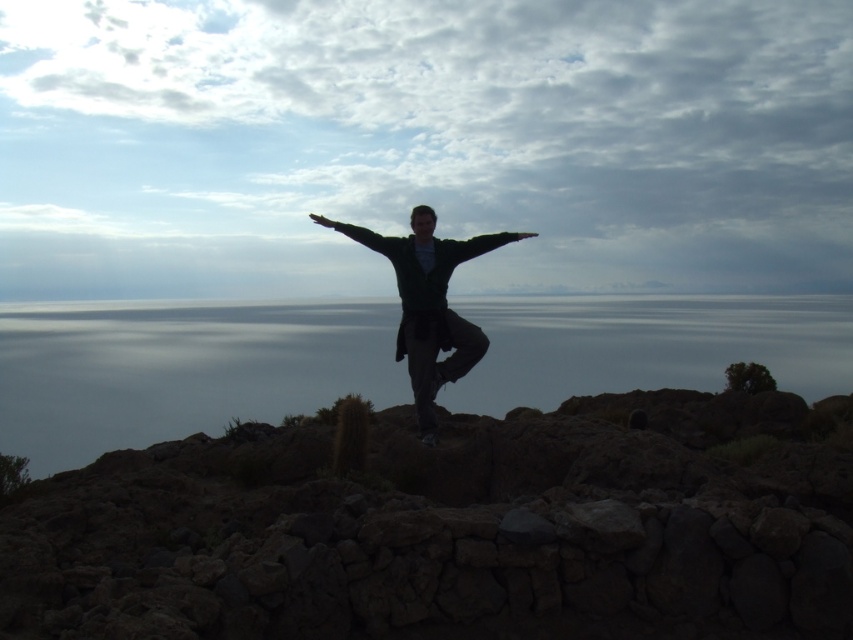
I want to click on gray water at center, so pyautogui.click(x=178, y=369).

Is point (126, 376) closer to camera compared to point (422, 228)?

That is False.

You are a GUI agent. You are given a task and a screenshot of the screen. Output one action in this format:
    pyautogui.click(x=<x>, y=<y>)
    Task: Click on the gray water at center
    The height and width of the screenshot is (640, 853).
    Given the screenshot: What is the action you would take?
    pyautogui.click(x=178, y=369)

Does dark stone wall at center appear over dark green sweater at center?

No.

Measure the distance between dark stone wall at center and camera.

They are 4.44 meters apart.

The image size is (853, 640). I want to click on dark stone wall at center, so click(x=456, y=529).

Can you confirm if dark stone wall at center is wider than gray water at center?

No.

Who is higher up, dark stone wall at center or gray water at center?

Positioned higher is gray water at center.

You are a GUI agent. You are given a task and a screenshot of the screen. Output one action in this format:
    pyautogui.click(x=<x>, y=<y>)
    Task: Click on the dark stone wall at center
    The width and height of the screenshot is (853, 640).
    Given the screenshot: What is the action you would take?
    pyautogui.click(x=456, y=529)